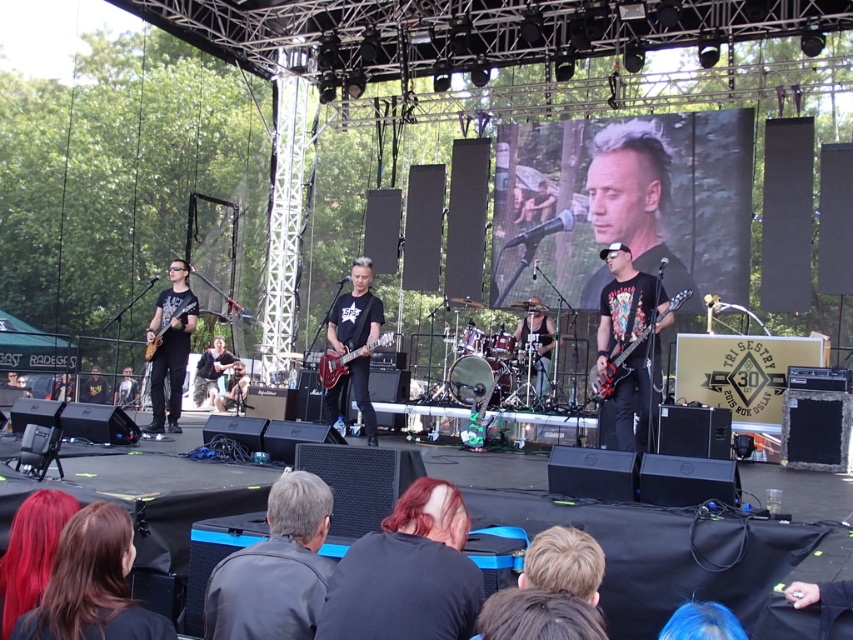
Is point (351, 323) closer to viewer compared to point (675, 300)?

No, (351, 323) is behind (675, 300).

Is matte black guitar at center wider than shiny black electric guitar at center?

No.

Image resolution: width=853 pixels, height=640 pixels. What do you see at coordinates (357, 336) in the screenshot?
I see `matte black guitar at center` at bounding box center [357, 336].

Locate an element on the screen. matte black guitar at center is located at coordinates (357, 336).

Which of these two, dark brown hair at lower center or shiny black electric guitar at center, stands taller?

shiny black electric guitar at center is taller.

Who is more distant from viewer, (440, 554) or (647, 324)?

The point (647, 324) is more distant.

Find the location of a particular element. dark brown hair at lower center is located at coordinates (407, 573).

Between matte black guitar at center and matte black guitar at left, which one is positioned higher?

matte black guitar at left is higher up.

Between point (366, 396) and point (171, 355), which one is positioned in front?

Positioned in front is point (366, 396).

Find the location of a particular element. matte black guitar at center is located at coordinates (357, 336).